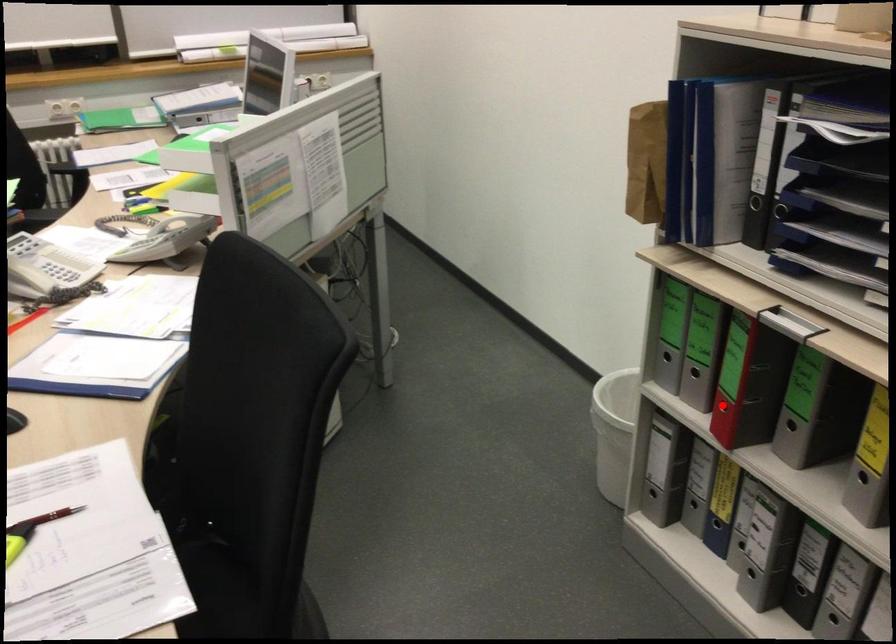
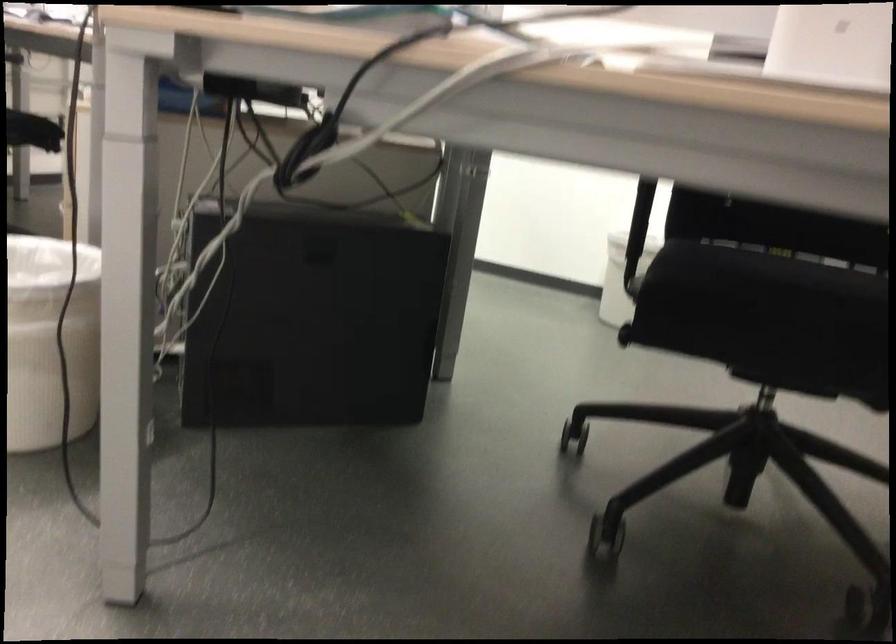
Question: I am providing you with two images of the same scene from different viewpoints. A red point is marked on the first image. Is the red point's position out of view in image 2?

Choices:
 (A) Yes
 (B) No

Answer: (A)